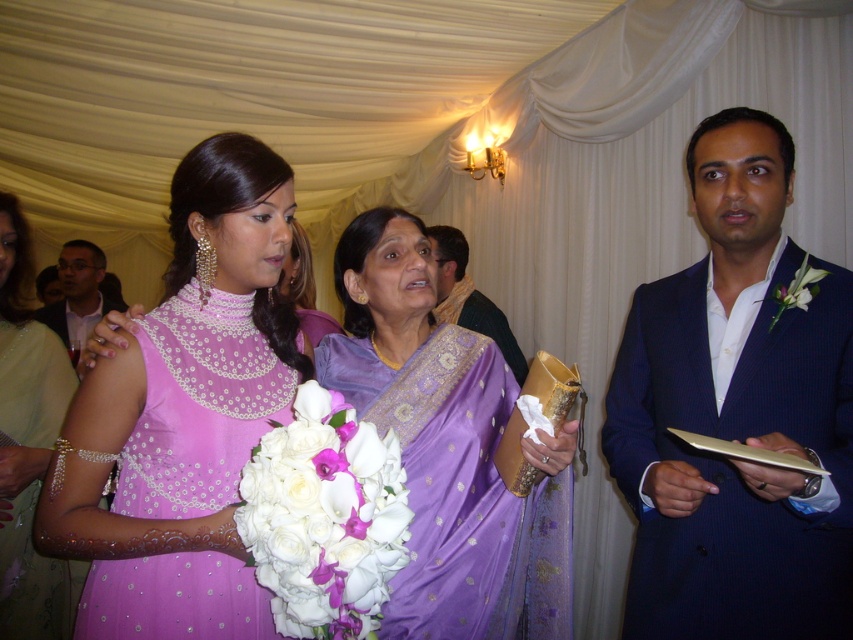
Question: Which point is farther to the camera?

Choices:
 (A) (347, 566)
 (B) (51, 355)
 (C) (727, 170)

Answer: (B)

Question: Among these points, which one is farthest from the camera?

Choices:
 (A) (22, 472)
 (B) (805, 333)
 (C) (376, 304)
 (D) (273, 500)

Answer: (A)

Question: Is satin purple saree at center positioned at the back of matte black suit at left?

Choices:
 (A) yes
 (B) no

Answer: (B)

Question: Is pink beaded dress at center to the right of white silk boutonniere at right from the viewer's perspective?

Choices:
 (A) yes
 (B) no

Answer: (B)

Question: Which object is closer to the camera taking this photo?

Choices:
 (A) matte black suit at left
 (B) white silk boutonniere at right

Answer: (B)

Question: Is matte black suit at left behind pink satin saree at center?

Choices:
 (A) yes
 (B) no

Answer: (A)